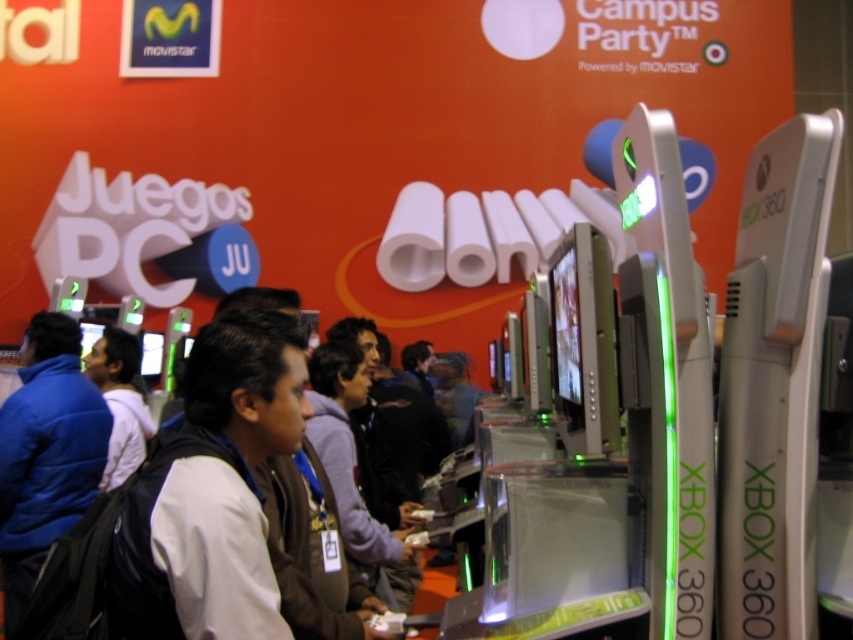
Question: Is blue puffy jacket at left bigger than brown fabric jacket at center?

Choices:
 (A) yes
 (B) no

Answer: (A)

Question: Among these points, which one is nearest to the camera?

Choices:
 (A) (45, 522)
 (B) (86, 371)
 (C) (355, 387)

Answer: (A)

Question: Does blue puffy jacket at left appear on the right side of brown fabric jacket at center?

Choices:
 (A) no
 (B) yes

Answer: (A)

Question: Which object appears farthest from the camera in this image?

Choices:
 (A) blue puffy jacket at left
 (B) white matte shirt at center
 (C) brown fabric jacket at center

Answer: (B)

Question: Can you confirm if brown fabric jacket at center is positioned to the left of white matte shirt at center?

Choices:
 (A) no
 (B) yes

Answer: (A)

Question: Which object appears closest to the camera in this image?

Choices:
 (A) blue puffy jacket at left
 (B) white matte shirt at center
 (C) brown fabric jacket at center

Answer: (A)